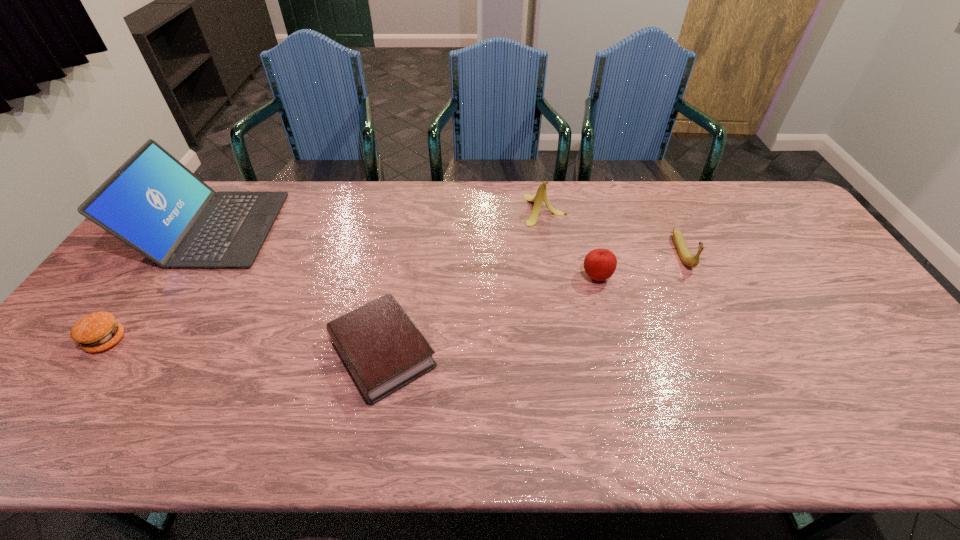
At what (x,y) coordinates should I click in order to perform the action: click on free location that satisfies the following two spatial constraints: 1. on the front side of the fourth object from right to left; 2. on the right side of the patty. Please return your answer as a coordinate pair (x, y). Image resolution: width=960 pixels, height=540 pixels. Looking at the image, I should click on point(98,353).

Locate an element on the screen. blank space that satisfies the following two spatial constraints: 1. on the back side of the Bible; 2. on the right side of the third shortest object is located at coordinates (396, 277).